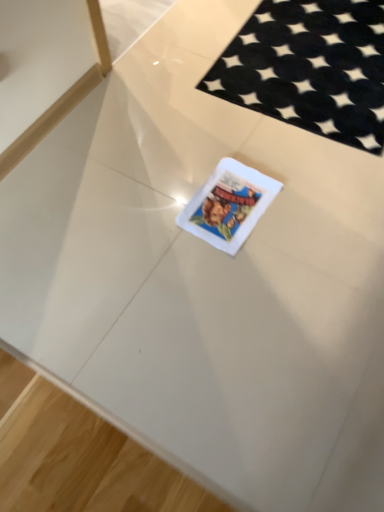
Where is `free spot above black felt mat at upper right (from a real-world perspective)`? free spot above black felt mat at upper right (from a real-world perspective) is located at coordinates (321, 47).